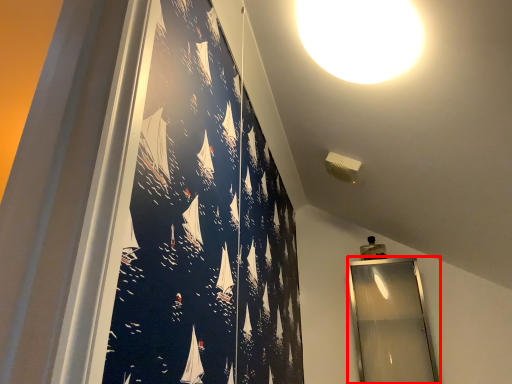
Question: Observing the image, what is the correct spatial positioning of mirror (annotated by the red box) in reference to lamp?

Choices:
 (A) left
 (B) right

Answer: (B)